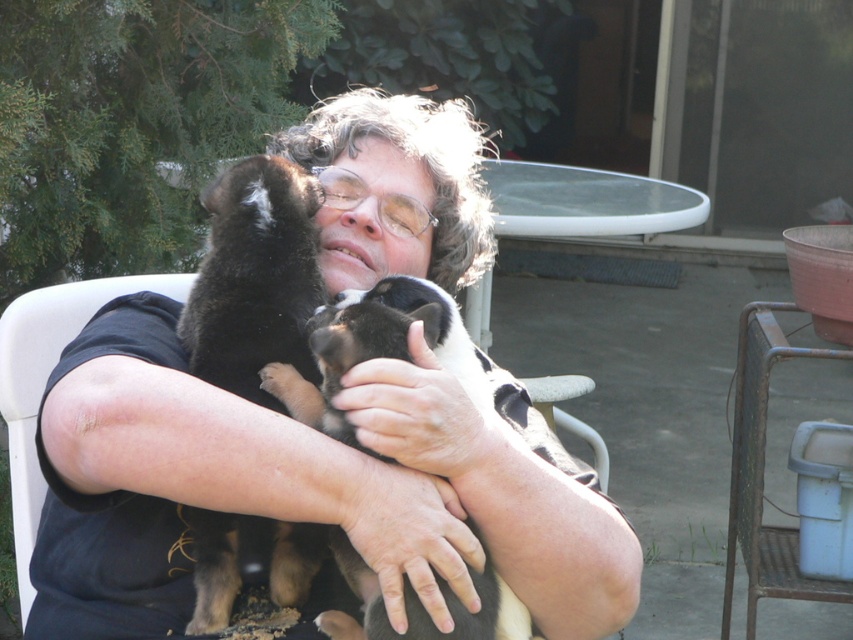
Question: Does black fabric shirt at center appear under black fur puppy at left?

Choices:
 (A) no
 (B) yes

Answer: (A)

Question: Which object appears closest to the camera in this image?

Choices:
 (A) black fabric shirt at center
 (B) black fur puppy at left

Answer: (A)

Question: Can you confirm if black fabric shirt at center is positioned above black fur puppy at left?

Choices:
 (A) no
 (B) yes

Answer: (B)

Question: Does black fabric shirt at center come in front of black fur puppy at left?

Choices:
 (A) no
 (B) yes

Answer: (B)